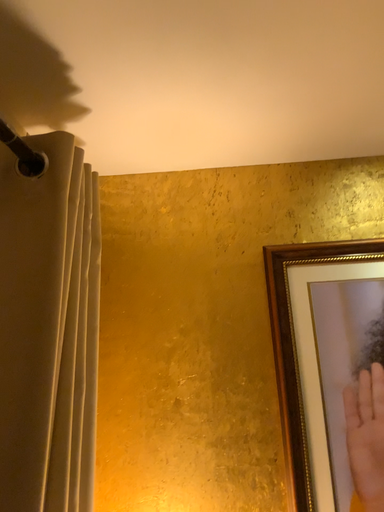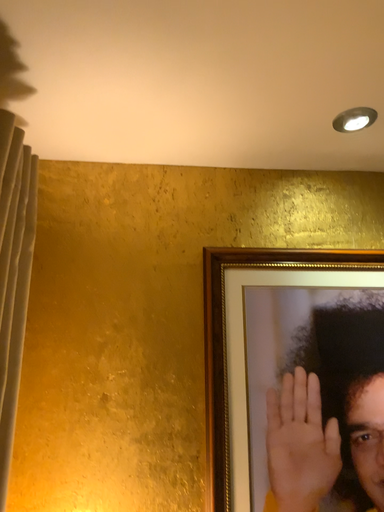
Question: Which way did the camera rotate in the video?

Choices:
 (A) rotated right
 (B) rotated left

Answer: (A)